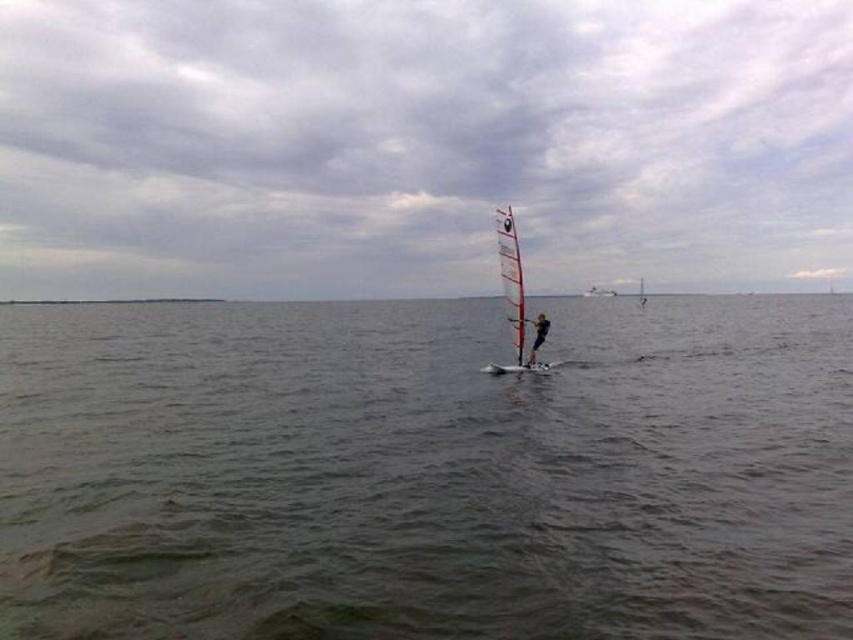
You are a boat operator who needs to safely navigate through the area shown in the image. The boat you are operating has a length of 3 meters. Considering the distance between the greenish water at center and the black fabric windsurfer at center, can your boat pass between them without touching either?

The greenish water at center and the black fabric windsurfer at center are 33.98 meters apart. Since your boat is only 3 meters long, there is sufficient space to pass between them without any issues.

You are a sailor on a boat anchored 30 meters away from the white glossy sail at center. You want to reach the greenish water at center where the sail is located. Is your boat able to reach that area?

The greenish water at center is 29.60 meters from the white glossy sail at center. Since your boat is anchored 30 meters away from the sail, it is slightly farther than the distance to the water, so you might need to move closer to reach the greenish water at center.